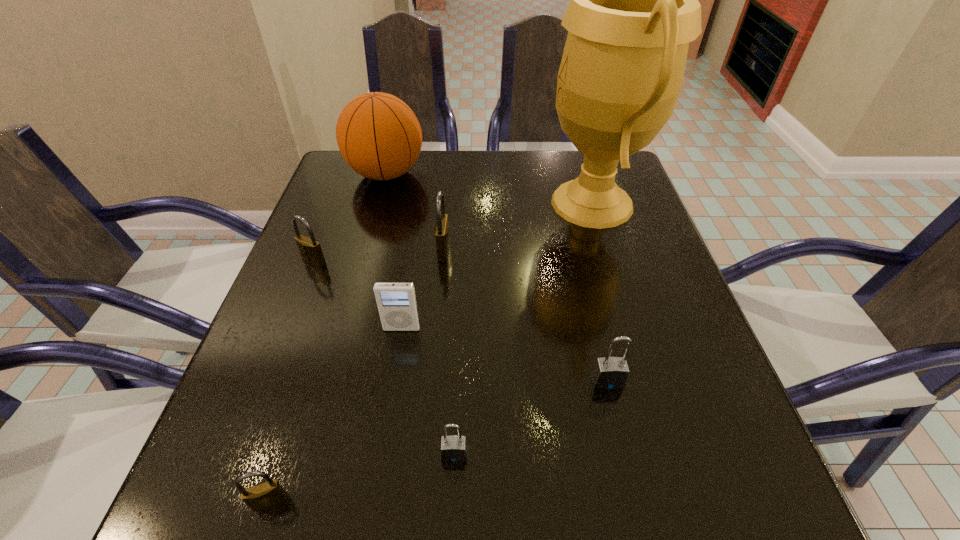
Image resolution: width=960 pixels, height=540 pixels. I want to click on object that is at the near left corner, so click(264, 495).

The image size is (960, 540). In order to click on object that is at the far right corner in this screenshot , I will do `click(634, 8)`.

Find the location of a particular element. This screenshot has height=540, width=960. vacant space at the far edge is located at coordinates (414, 188).

Where is `free point at the near edge`? free point at the near edge is located at coordinates (560, 489).

In the image, there is a desktop. Identify the location of vacant region at the left edge. Image resolution: width=960 pixels, height=540 pixels. (340, 220).

You are a GUI agent. You are given a task and a screenshot of the screen. Output one action in this format:
    pyautogui.click(x=<x>, y=<y>)
    Task: Click on the vacant space at the right edge of the desktop
    This screenshot has width=960, height=540.
    Given the screenshot: What is the action you would take?
    pyautogui.click(x=633, y=242)

At what (x,y) coordinates should I click in order to perform the action: click on free space at the far right corner of the desktop. Please return your answer as a coordinate pair (x, y). Looking at the image, I should click on (577, 163).

This screenshot has height=540, width=960. Find the location of `free space at the near right corner`. free space at the near right corner is located at coordinates (679, 467).

Locate an element on the screen. This screenshot has width=960, height=540. free space between the third object from right to left and the tallest padlock is located at coordinates (449, 352).

At what (x,y) coordinates should I click in order to perform the action: click on vacant area that lies between the left gray padlock and the basketball. Please return your answer as a coordinate pair (x, y). Looking at the image, I should click on 420,314.